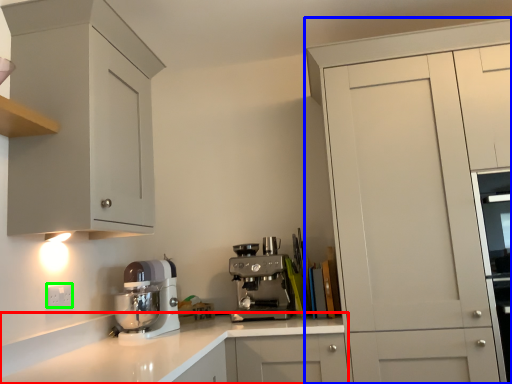
Question: Estimate the real-world distances between objects in this image. Which object is farther from countertop (highlighted by a red box), cabinetry (highlighted by a blue box) or electric outlet (highlighted by a green box)?

Choices:
 (A) cabinetry
 (B) electric outlet

Answer: (A)